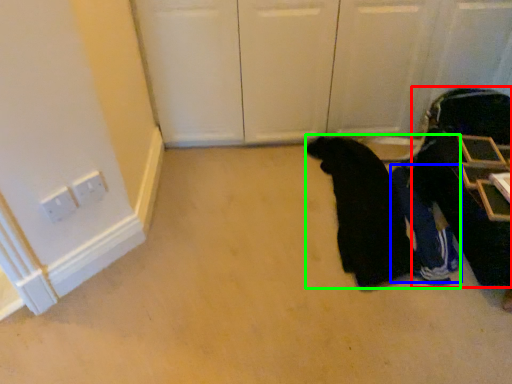
Question: Which is farther away from luggage (highlighted by a red box)? person (highlighted by a blue box) or person (highlighted by a green box)?

Choices:
 (A) person
 (B) person

Answer: (B)